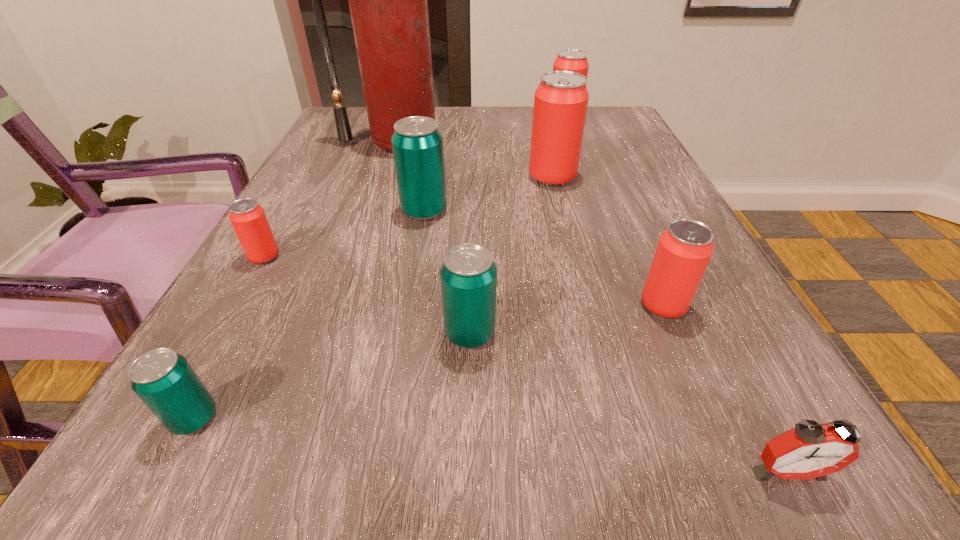
Find the location of a particular element. This screenshot has width=960, height=540. object located at the far left corner is located at coordinates (388, 4).

Identify the location of object situated at the near left corner. This screenshot has height=540, width=960. (164, 380).

I want to click on object at the far right corner, so click(x=574, y=60).

This screenshot has height=540, width=960. I want to click on object positioned at the near right corner, so click(810, 450).

The height and width of the screenshot is (540, 960). Find the location of `vacant space at the far edge of the desktop`. vacant space at the far edge of the desktop is located at coordinates (477, 123).

In the image, there is a desktop. Where is `blank space at the left edge`? This screenshot has height=540, width=960. blank space at the left edge is located at coordinates (300, 247).

Image resolution: width=960 pixels, height=540 pixels. I want to click on vacant space at the right edge of the desktop, so 734,318.

Locate an element on the screen. free space at the far left corner is located at coordinates (328, 136).

I want to click on vacant area at the near left corner of the desktop, so click(253, 510).

This screenshot has width=960, height=540. Find the location of `vacant area at the far right corner`. vacant area at the far right corner is located at coordinates (636, 137).